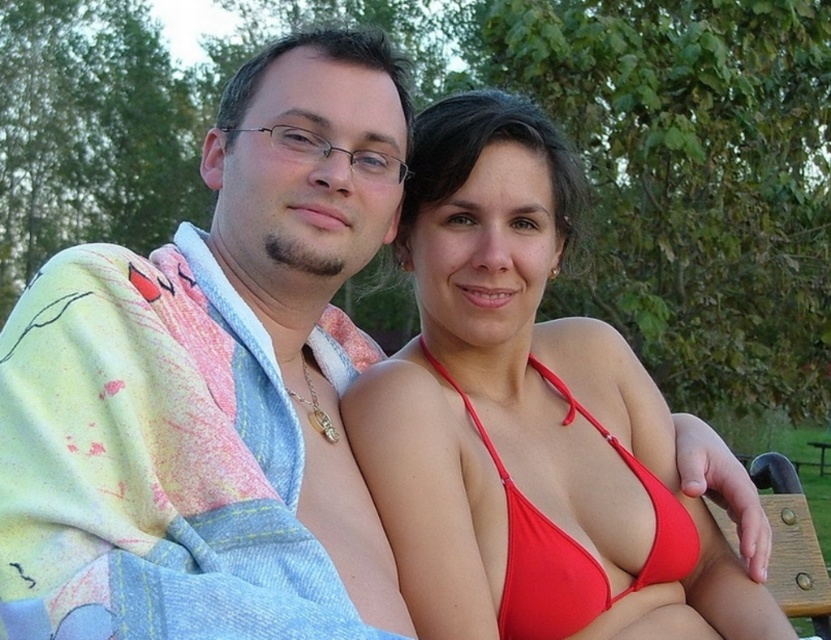
Two people are sitting in a park. The person on the left is wearing a light colored robe with a gold necklace. The person on the right is wearing a dark colored jacket. There is a point at (x=283, y=440) between them. If the distance between them is 5.23 feet, can a 6 feet long rope be placed between them to connect both ends?

The distance between the two people is 5.23 feet, and the rope is 6 feet long. Since the rope is longer than the distance between them, it can easily be placed between them to connect both ends.